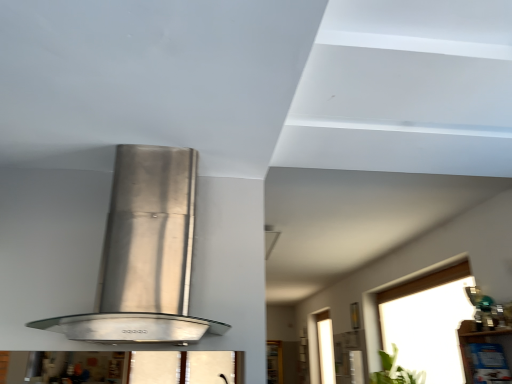
Question: From the image's perspective, is clear glass window at upper right located above or below green leafy plant at lower right?

Choices:
 (A) below
 (B) above

Answer: (B)

Question: In terms of height, does clear glass window at upper right look taller or shorter compared to green leafy plant at lower right?

Choices:
 (A) short
 (B) tall

Answer: (B)

Question: Which object is the farthest from the satin silver range hood at center?

Choices:
 (A) green leafy plant at lower right
 (B) clear glass window at upper right

Answer: (A)

Question: Which is nearer to the green leafy plant at lower right?

Choices:
 (A) satin silver range hood at center
 (B) clear glass window at upper right

Answer: (B)